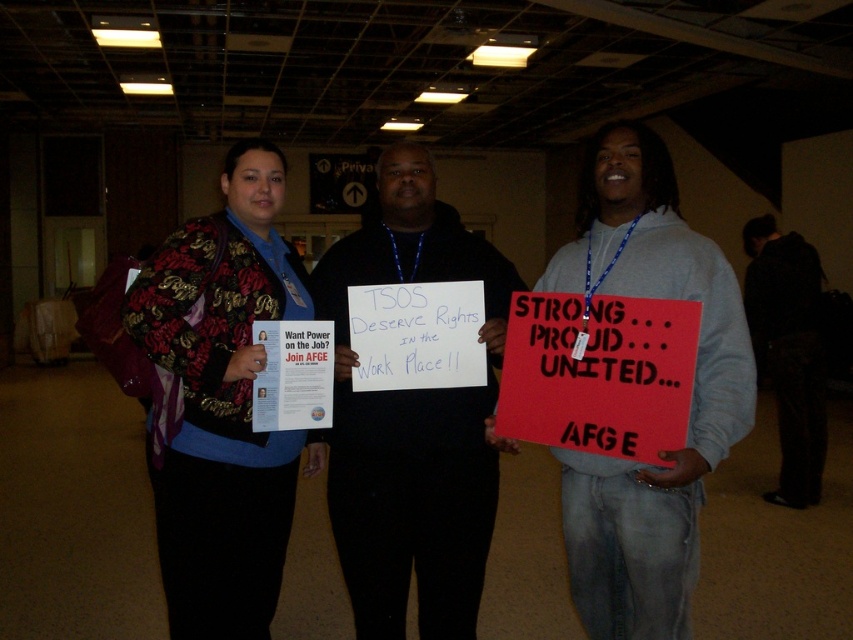
You are organizing a protest and need to decide which of the two items, the matte black shirt at center or the dark fabric pants at right, can fit into a small storage box. Based on their sizes, which one is more likely to fit?

The matte black shirt at center is more likely to fit into the small storage box because it occupies less space than the dark fabric pants at right according to the description.

You are a photographer at this event and need to arrange the two subjects for a portrait. The matte black shirt at center and the dark fabric pants at right must be in the frame. Based on their positions, which subject should be positioned closer to the camera to ensure both are clearly visible?

The matte black shirt at center should be positioned closer to the camera because it is to the left of the dark fabric pants at right, so moving it forward will keep both subjects in clear view.